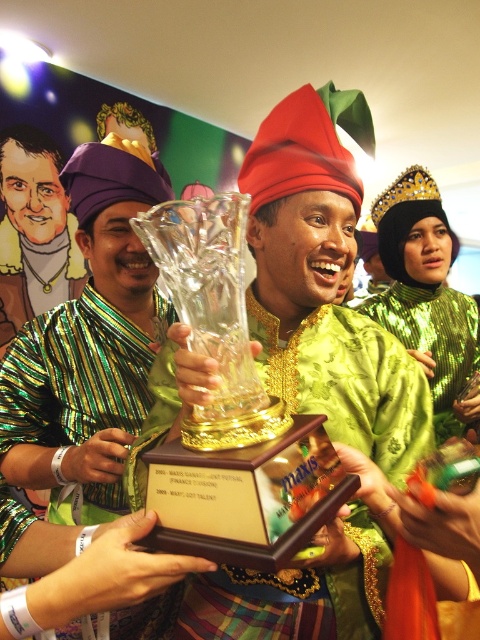
Looking at this image, who is higher up, clear glass trophy at center or green sequined dress at center?

green sequined dress at center is above.

Between point (170, 256) and point (374, 205), which one is positioned behind?

Point (374, 205)

Locate an element on the screen. The width and height of the screenshot is (480, 640). clear glass trophy at center is located at coordinates (214, 314).

The height and width of the screenshot is (640, 480). I want to click on clear glass trophy at center, so click(214, 314).

Who is taller, clear glass trophy at center or green striped shirt at center?

With more height is green striped shirt at center.

Does point (204, 218) come farther from viewer compared to point (72, 292)?

No, (204, 218) is closer to viewer.

Image resolution: width=480 pixels, height=640 pixels. Find the location of `clear glass trophy at center`. clear glass trophy at center is located at coordinates (214, 314).

Can you confirm if green sequined dress at center is thinner than green striped shirt at center?

In fact, green sequined dress at center might be wider than green striped shirt at center.

Looking at this image, who is taller, green sequined dress at center or green striped shirt at center?

Standing taller between the two is green striped shirt at center.

Is point (468, 305) farther from camera compared to point (35, 221)?

That is False.

Locate an element on the screen. This screenshot has width=480, height=640. green sequined dress at center is located at coordinates (427, 296).